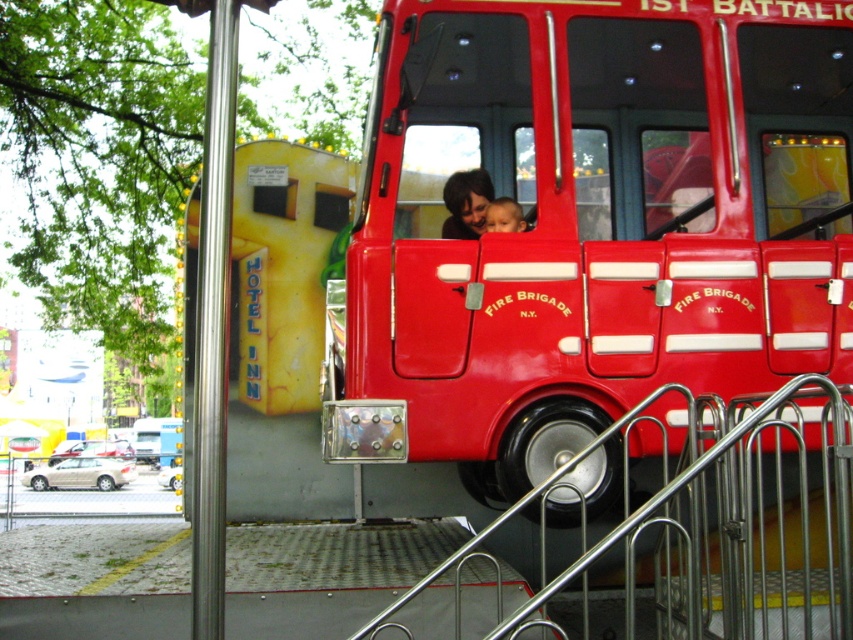
You are standing at the metal railing in front of the fire truck. There are two points marked inside the truck. Which point is closer to you, point at (503, 134) or point at (846, 452)?

Point at (846, 452) is closer to you because it is in front of point at (503, 134).

You are a parent trying to decide if your child can comfortably sit on the shiny red fire truck at center without touching the smooth skin face at center. Can they?

The shiny red fire truck at center is much taller than the smooth skin face at center, so the child can comfortably sit on the shiny red fire truck at center without touching the smooth skin face at center.